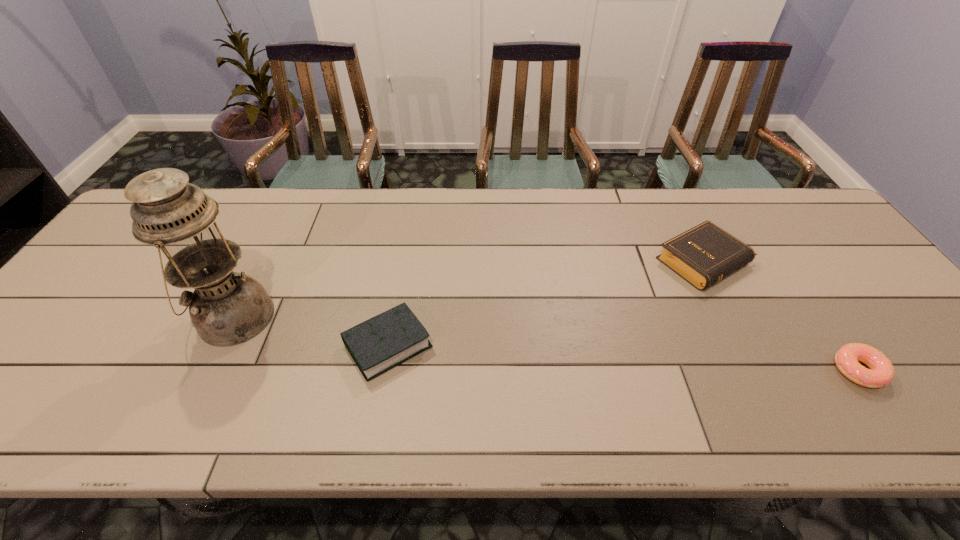
Locate an element on the screen. empty location between the second object from right to left and the third object from right to left is located at coordinates (546, 303).

The width and height of the screenshot is (960, 540). I want to click on free area in between the nearer Bible and the doughnut, so click(x=623, y=358).

This screenshot has width=960, height=540. Identify the location of vacant area that lies between the doughnut and the leftmost object. (546, 344).

This screenshot has width=960, height=540. What are the coordinates of `unoccupied position between the rightmost object and the second object from left to right` in the screenshot? It's located at (623, 358).

This screenshot has width=960, height=540. In order to click on vacant space that is in between the tallest object and the third object from right to left in this screenshot , I will do `click(311, 332)`.

Where is `vacant point located between the farther Bible and the leftmost object`? This screenshot has width=960, height=540. vacant point located between the farther Bible and the leftmost object is located at coordinates (469, 289).

The image size is (960, 540). Find the location of `vacant area that lies between the rightmost object and the nearer Bible`. vacant area that lies between the rightmost object and the nearer Bible is located at coordinates (623, 358).

Select which object is the second closest to the oil lamp. Please provide its 2D coordinates. Your answer should be formatted as a tuple, i.e. [(x, y)], where the tuple contains the x and y coordinates of a point satisfying the conditions above.

[(705, 254)]

Find the location of a particular element. the closest object to the farther Bible is located at coordinates (881, 372).

Identify the location of vacant area in the image that satisfies the following two spatial constraints: 1. on the front side of the doughnut; 2. on the left side of the farther Bible. (760, 370).